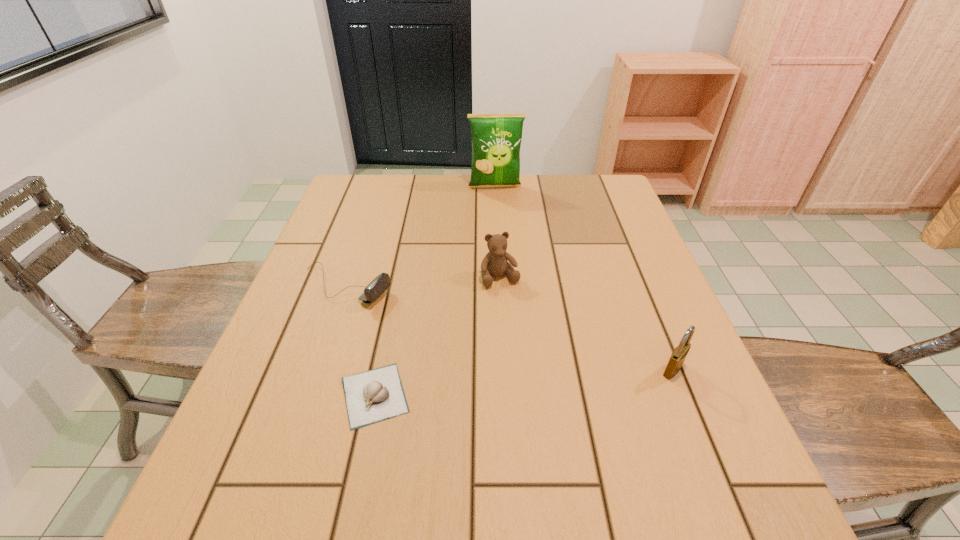
At what (x,y) coordinates should I click in order to perform the action: click on blank space that satisfies the following two spatial constraints: 1. on the back side of the crisp (potato chip); 2. on the left side of the shortest object. Please return your answer as a coordinate pair (x, y). The width and height of the screenshot is (960, 540). Looking at the image, I should click on (419, 187).

The height and width of the screenshot is (540, 960). Find the location of `vacant area that satisfies the following two spatial constraints: 1. on the back side of the teddy bear; 2. on the right side of the shortest object`. vacant area that satisfies the following two spatial constraints: 1. on the back side of the teddy bear; 2. on the right side of the shortest object is located at coordinates (399, 278).